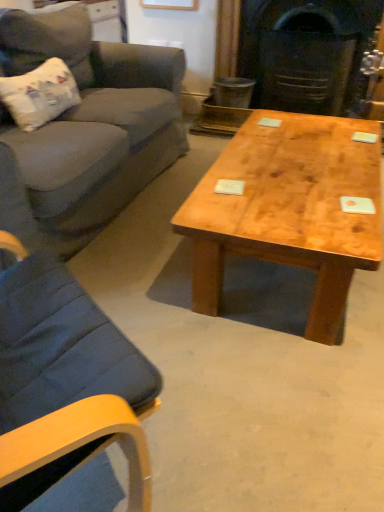
Question: From the image's perspective, is white paper-like pillow at left located beneath natural wood coffee table at center?

Choices:
 (A) yes
 (B) no

Answer: (B)

Question: Is white paper-like pillow at left to the left of natural wood coffee table at center from the viewer's perspective?

Choices:
 (A) no
 (B) yes

Answer: (B)

Question: From the image's perspective, would you say white paper-like pillow at left is positioned over natural wood coffee table at center?

Choices:
 (A) no
 (B) yes

Answer: (B)

Question: Can you confirm if white paper-like pillow at left is bigger than natural wood coffee table at center?

Choices:
 (A) no
 (B) yes

Answer: (A)

Question: Is white paper-like pillow at left positioned beyond the bounds of natural wood coffee table at center?

Choices:
 (A) no
 (B) yes

Answer: (B)

Question: Which is correct: dark gray stone fireplace at center is inside white paper-like pillow at left, or outside of it?

Choices:
 (A) outside
 (B) inside

Answer: (A)

Question: Is dark gray stone fireplace at center wider or thinner than white paper-like pillow at left?

Choices:
 (A) wide
 (B) thin

Answer: (A)

Question: In terms of height, does dark gray stone fireplace at center look taller or shorter compared to white paper-like pillow at left?

Choices:
 (A) short
 (B) tall

Answer: (B)

Question: Considering the positions of point (329, 67) and point (33, 108), is point (329, 67) closer or farther from the camera than point (33, 108)?

Choices:
 (A) farther
 (B) closer

Answer: (A)

Question: In terms of height, does velvet gray couch at left look taller or shorter compared to white paper-like pillow at left?

Choices:
 (A) short
 (B) tall

Answer: (B)

Question: From a real-world perspective, is velvet gray couch at left above or below white paper-like pillow at left?

Choices:
 (A) above
 (B) below

Answer: (B)

Question: Is velvet gray couch at left in front of or behind white paper-like pillow at left in the image?

Choices:
 (A) behind
 (B) front

Answer: (B)

Question: Is velvet gray couch at left spatially inside white paper-like pillow at left, or outside of it?

Choices:
 (A) inside
 (B) outside

Answer: (B)

Question: Is white paper-like pillow at left in front of or behind natural wood coffee table at center in the image?

Choices:
 (A) front
 (B) behind

Answer: (B)

Question: Based on their sizes in the image, would you say white paper-like pillow at left is bigger or smaller than natural wood coffee table at center?

Choices:
 (A) small
 (B) big

Answer: (A)